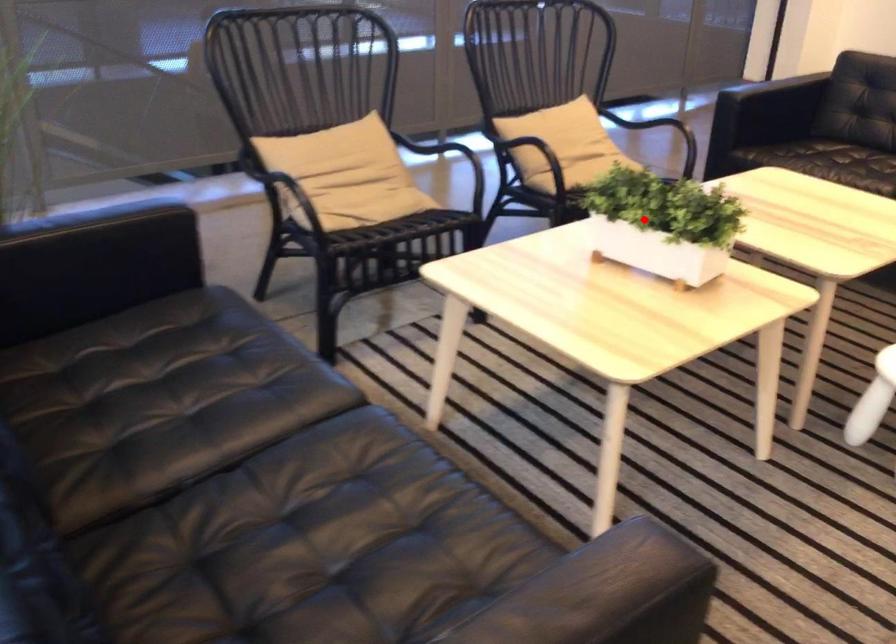
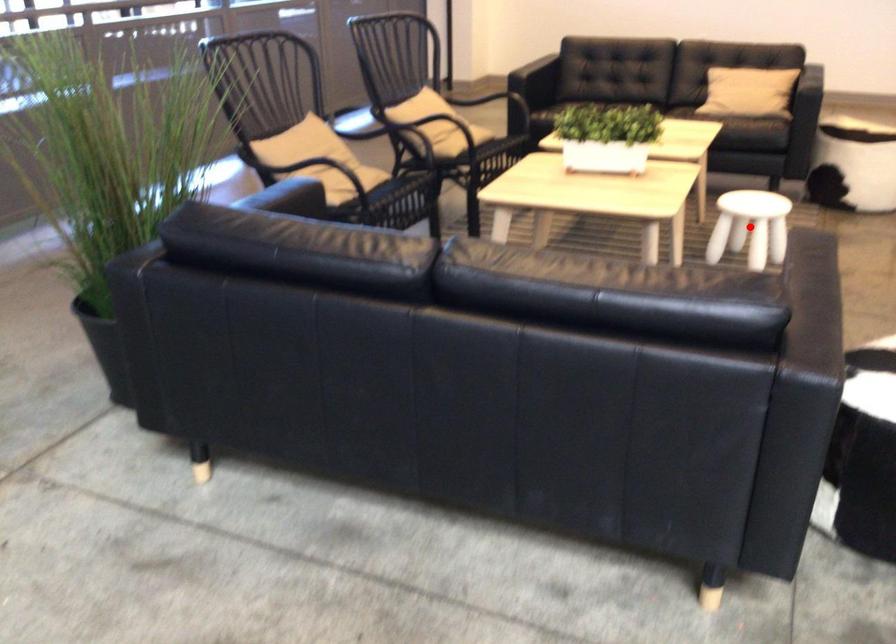
I am providing you with two images of the same scene from different viewpoints. A red point is marked on the first image and another point is marked on the second image. Is the marked point in image1 the same physical position as the marked point in image2?

No